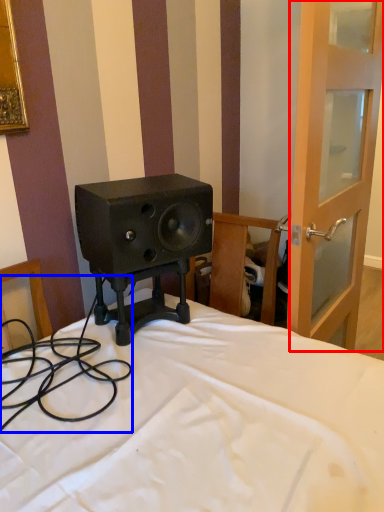
Question: Which object is closer to the camera taking this photo, screen door (highlighted by a red box) or cable (highlighted by a blue box)?

Choices:
 (A) screen door
 (B) cable

Answer: (B)